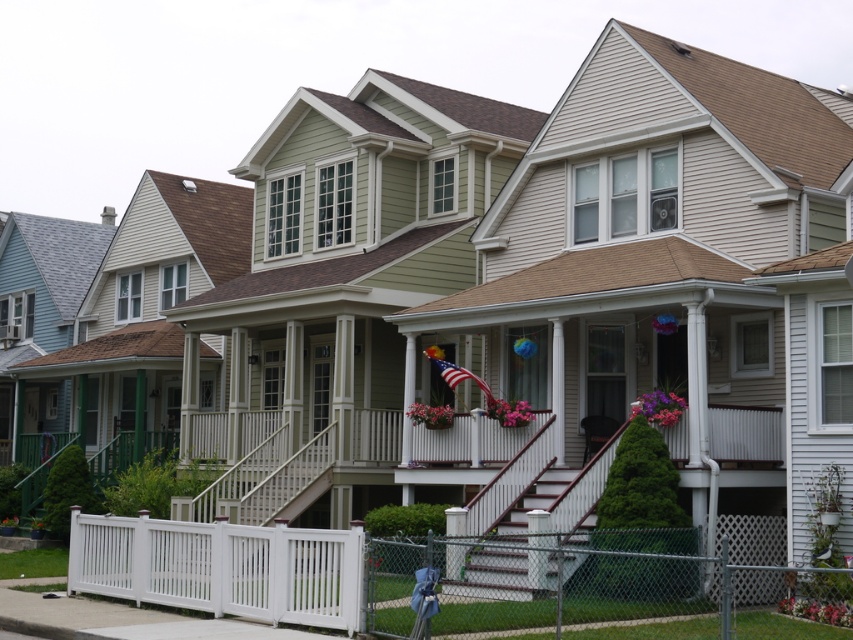
Question: Can you confirm if white vinyl fence at lower left is wider than white wooden stairs at center?

Choices:
 (A) no
 (B) yes

Answer: (B)

Question: Which of the following is the farthest from the observer?

Choices:
 (A) (543, 566)
 (B) (730, 588)

Answer: (A)

Question: Can you confirm if white vinyl fence at lower left is bigger than white wooden stairs at center?

Choices:
 (A) yes
 (B) no

Answer: (A)

Question: Can you confirm if white vinyl fence at lower left is thinner than white wooden stairs at center?

Choices:
 (A) no
 (B) yes

Answer: (A)